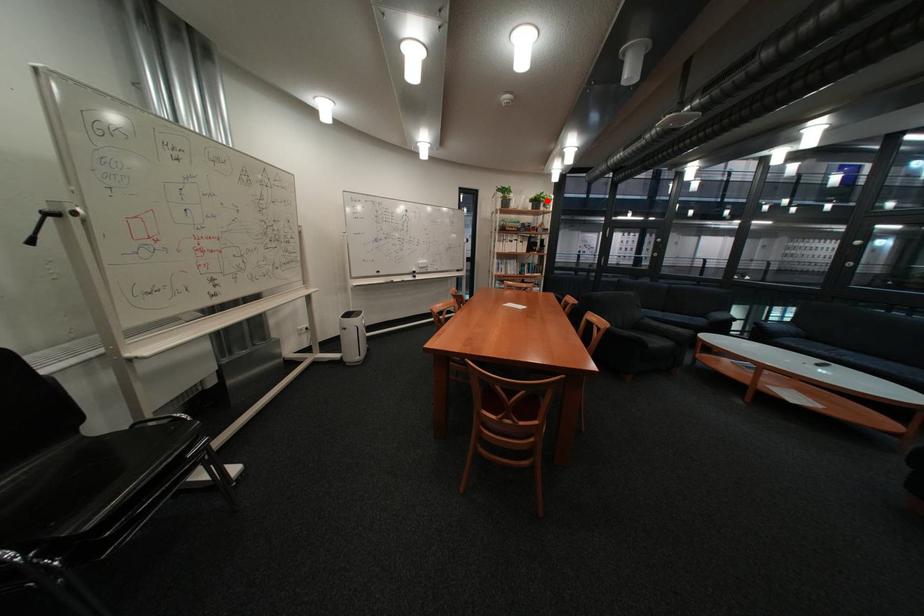
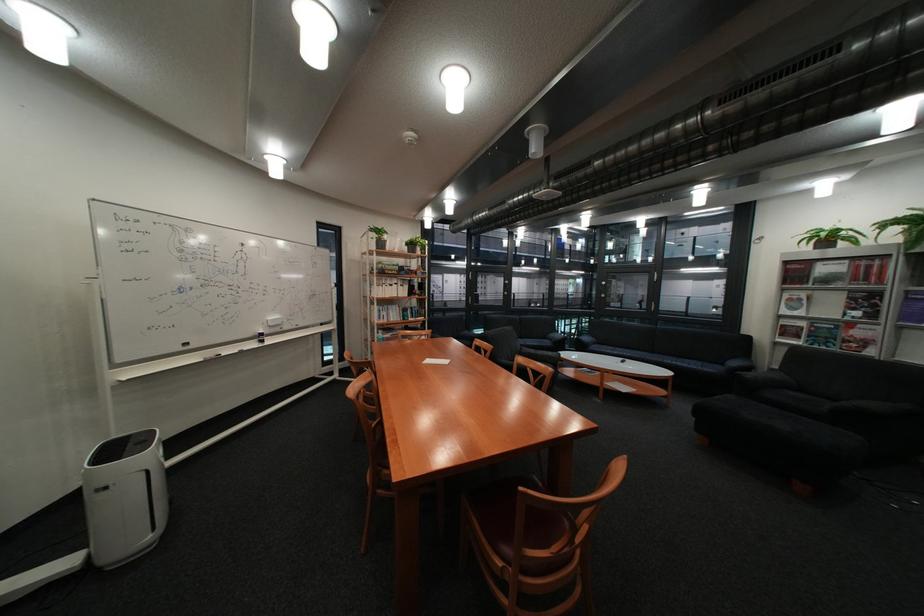
Question: I am providing you with two images of the same scene from different viewpoints. Image1 has a red point marked. In image2, the corresponding 3D location appears at what relative position? Reply with the corresponding letter.

Choices:
 (A) Closer
 (B) Farther

Answer: (B)